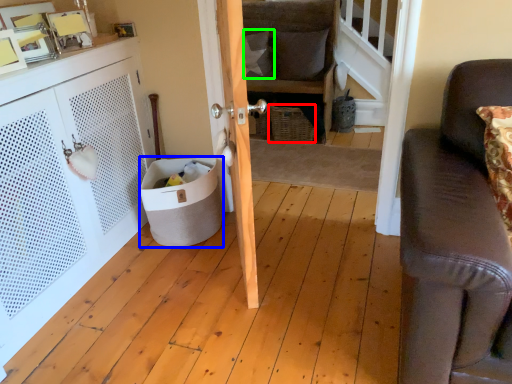
Question: Which is farther away from basket (highlighted by a red box)? trash bin/can (highlighted by a blue box) or pillow (highlighted by a green box)?

Choices:
 (A) trash bin/can
 (B) pillow

Answer: (A)